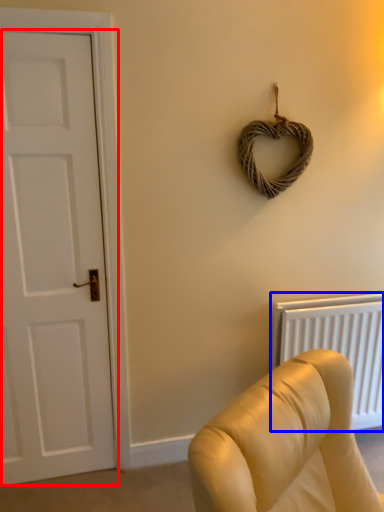
Question: Which of the following is the farthest to the observer, door (highlighted by a red box) or radiator (highlighted by a blue box)?

Choices:
 (A) door
 (B) radiator

Answer: (B)